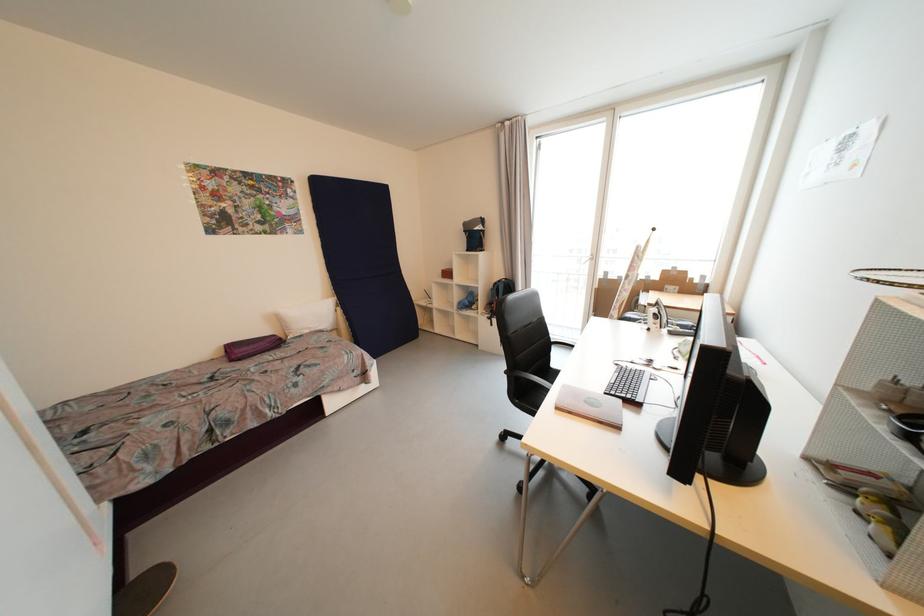
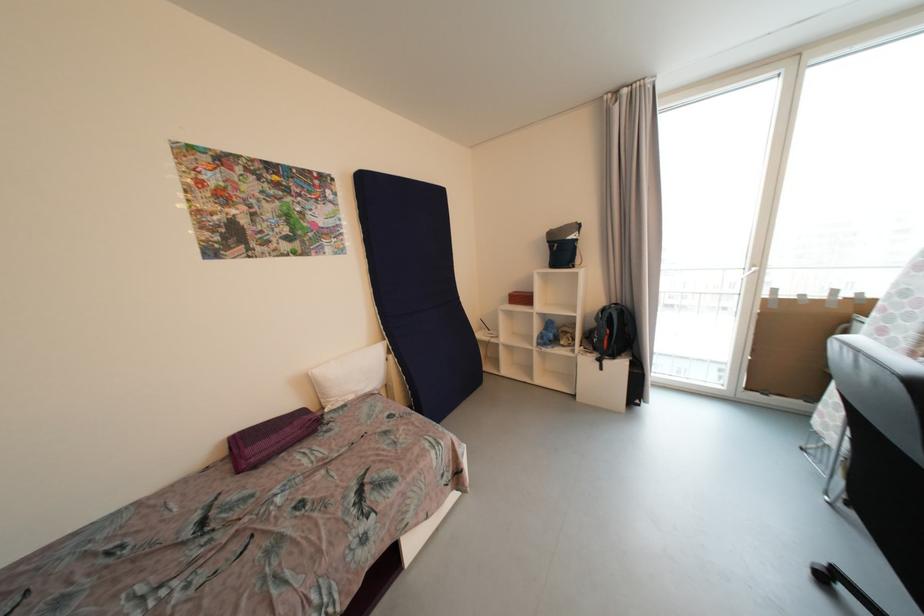
Find the pixel in the second image that matches (465,305) in the first image.

(545, 339)